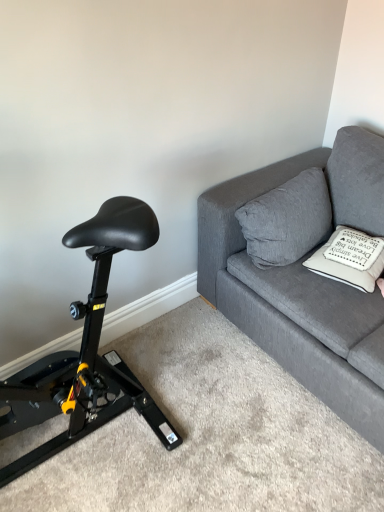
Locate an element on the screen. This screenshot has width=384, height=512. blank space above white soft cushion at upper right, which is counted as the second pillow, starting from the left (from a real-world perspective) is located at coordinates (365, 245).